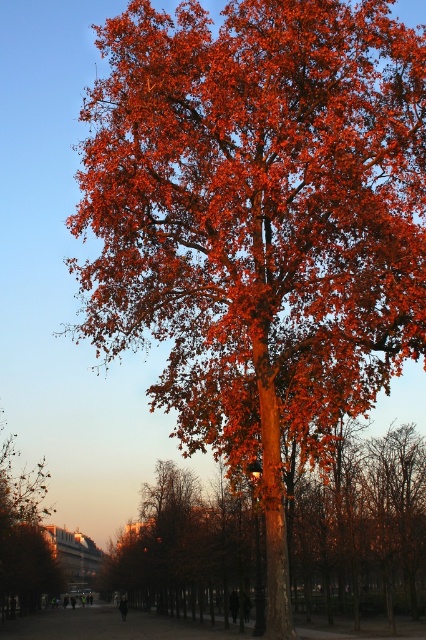
Who is lower down, shiny orange leaves at center or orange-brown bark tree at lower left?

orange-brown bark tree at lower left is below.

Who is more distant from viewer, [233,532] or [13,508]?

The point [13,508] is more distant.

Locate an element on the screen. The height and width of the screenshot is (640, 426). shiny orange leaves at center is located at coordinates (362, 531).